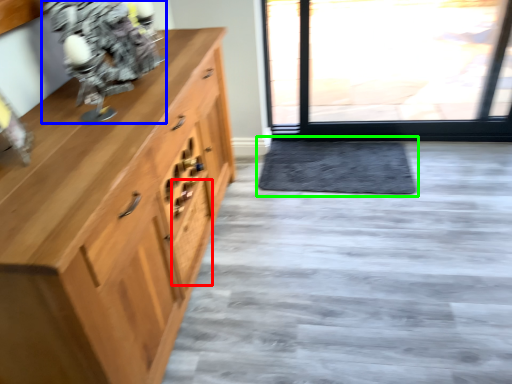
Question: Estimate the real-world distances between objects in this image. Which object is farther from drawer (highlighted by a red box), figurine (highlighted by a blue box) or doormat (highlighted by a green box)?

Choices:
 (A) figurine
 (B) doormat

Answer: (B)